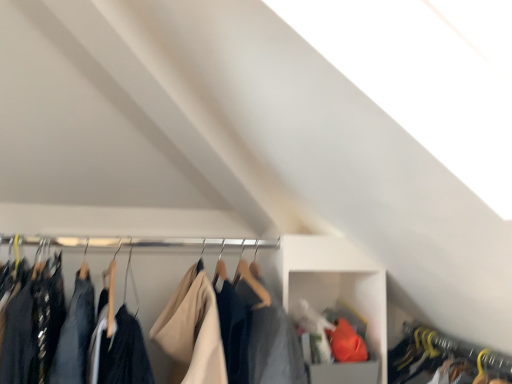
Question: Do you think white plastic cabinet at center is within yellow hanger at lower right, which is the 2th closet from left to right, or outside of it?

Choices:
 (A) inside
 (B) outside

Answer: (B)

Question: Is white plastic cabinet at center in front of or behind yellow hanger at lower right, which is the first closet from right to left, in the image?

Choices:
 (A) behind
 (B) front

Answer: (A)

Question: Estimate the real-world distances between objects in this image. Which object is closer to the yellow hanger at lower right, which is the 2th closet from left to right?

Choices:
 (A) white plastic cabinet at center
 (B) dark blue fabric at center, the second closet when ordered from right to left

Answer: (A)

Question: Based on their relative distances, which object is farther from the dark blue fabric at center, placed as the first closet when sorted from left to right?

Choices:
 (A) white plastic cabinet at center
 (B) yellow hanger at lower right, which is the first closet from right to left

Answer: (B)